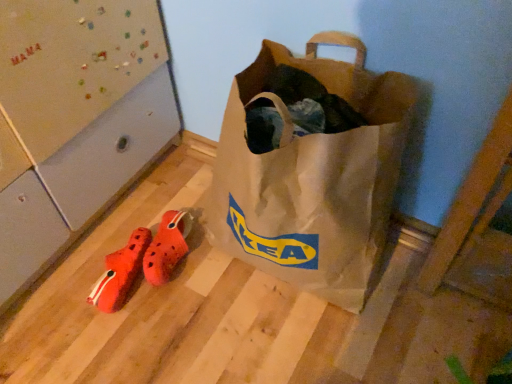
Find the location of `space that is in front of orange rubber clogs at lower left`. space that is in front of orange rubber clogs at lower left is located at coordinates (164, 333).